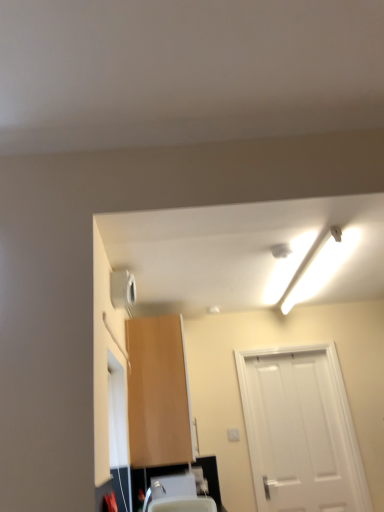
Question: Is satin nickel faucet at lower center completely or partially inside white plastic sink at lower center?

Choices:
 (A) yes
 (B) no

Answer: (B)

Question: Does white plastic sink at lower center appear on the left side of satin nickel faucet at lower center?

Choices:
 (A) yes
 (B) no

Answer: (B)

Question: Is white plastic sink at lower center facing towards satin nickel faucet at lower center?

Choices:
 (A) no
 (B) yes

Answer: (B)

Question: Is white plastic sink at lower center at the right side of satin nickel faucet at lower center?

Choices:
 (A) no
 (B) yes

Answer: (B)

Question: Is the position of white plastic sink at lower center less distant than that of satin nickel faucet at lower center?

Choices:
 (A) no
 (B) yes

Answer: (A)

Question: Considering the relative sizes of white plastic sink at lower center and satin nickel faucet at lower center in the image provided, is white plastic sink at lower center taller than satin nickel faucet at lower center?

Choices:
 (A) no
 (B) yes

Answer: (B)

Question: From a real-world perspective, is white matte door at right located higher than satin nickel faucet at lower center?

Choices:
 (A) yes
 (B) no

Answer: (A)

Question: Can you confirm if white matte door at right is bigger than satin nickel faucet at lower center?

Choices:
 (A) no
 (B) yes

Answer: (B)

Question: Considering the relative sizes of white matte door at right and satin nickel faucet at lower center in the image provided, is white matte door at right shorter than satin nickel faucet at lower center?

Choices:
 (A) yes
 (B) no

Answer: (B)

Question: From the image's perspective, would you say white matte door at right is shown under satin nickel faucet at lower center?

Choices:
 (A) yes
 (B) no

Answer: (A)

Question: Would you say white matte door at right is a long distance from satin nickel faucet at lower center?

Choices:
 (A) yes
 (B) no

Answer: (A)

Question: From the image's perspective, is white matte door at right on top of satin nickel faucet at lower center?

Choices:
 (A) no
 (B) yes

Answer: (A)

Question: Considering the relative sizes of light brown wood cabinet at center and white matte door at right in the image provided, is light brown wood cabinet at center thinner than white matte door at right?

Choices:
 (A) no
 (B) yes

Answer: (A)